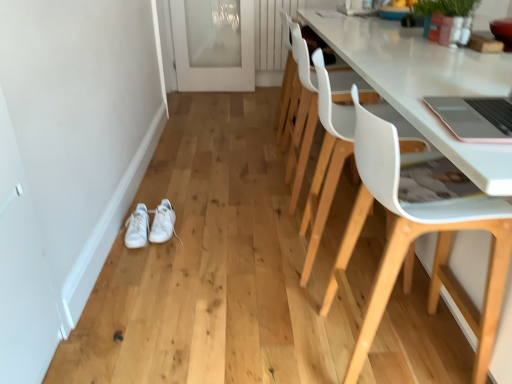
Locate an element on the screen. This screenshot has height=384, width=512. white leather sneakers at lower left, which is counted as the 1th footwear, starting from the right is located at coordinates (163, 223).

In order to face white plastic chair at center, the first chair in the back-to-front sequence, should I rotate leftwards or rightwards?

Rotate your view right by about 10.104°.

Measure the distance between white plastic chair at right, the first chair in the front-to-back sequence, and camera.

37.41 inches.

This screenshot has height=384, width=512. Describe the element at coordinates (137, 228) in the screenshot. I see `white leather sneakers at lower left, the second footwear from the right` at that location.

Locate an element on the screen. white leather sneakers at lower left, which is counted as the 1th footwear, starting from the right is located at coordinates (163, 223).

Can you tell me how much white plastic chair at right, marked as the second chair in a back-to-front arrangement, and white plastic chair at right, which is the 3th chair in back-to-front order, differ in facing direction?

The angular difference between white plastic chair at right, marked as the second chair in a back-to-front arrangement, and white plastic chair at right, which is the 3th chair in back-to-front order, is 6.26 degrees.

From the image's perspective, which object appears higher, white plastic chair at right, marked as the second chair in a back-to-front arrangement, or white plastic chair at right, which is the 3th chair in back-to-front order?

white plastic chair at right, marked as the second chair in a back-to-front arrangement, is shown above in the image.

Would you say white plastic chair at right, the first chair in the front-to-back sequence, is part of white plastic chair at right, which appears as the 2th chair when viewed from the front,'s contents?

Definitely not — white plastic chair at right, the first chair in the front-to-back sequence, is not inside white plastic chair at right, which appears as the 2th chair when viewed from the front.

From the picture: Considering the sizes of objects white leather sneakers at lower left, which is counted as the first footwear, starting from the left, and white leather sneakers at lower left, which is counted as the 1th footwear, starting from the right, in the image provided, who is taller, white leather sneakers at lower left, which is counted as the first footwear, starting from the left, or white leather sneakers at lower left, which is counted as the 1th footwear, starting from the right,?

With more height is white leather sneakers at lower left, which is counted as the first footwear, starting from the left.

From the image's perspective, which is below, white leather sneakers at lower left, the second footwear from the right, or white leather sneakers at lower left, which is counted as the 1th footwear, starting from the right?

white leather sneakers at lower left, the second footwear from the right, appears lower in the image.

The image size is (512, 384). Identify the location of footwear above the white leather sneakers at lower left, which is counted as the first footwear, starting from the left (from the image's perspective). (163, 223).

Does point (131, 235) lie behind point (167, 225)?

No.

Which of these two, white leather sneakers at lower left, marked as the 2th footwear in a left-to-right arrangement, or white plastic chair at right, which is the 3th chair in back-to-front order, stands taller?

white plastic chair at right, which is the 3th chair in back-to-front order, is taller.

Does white leather sneakers at lower left, which is counted as the 1th footwear, starting from the right, appear on the left side of white plastic chair at right, the first chair in the front-to-back sequence?

Yes.

Is point (173, 218) closer to viewer compared to point (356, 161)?

No.

From a real-world perspective, is white plastic chair at right, which is the 3th chair in back-to-front order, positioned over white plastic chair at center, the first chair in the back-to-front sequence, based on gravity?

Incorrect, from a real-world perspective, white plastic chair at right, which is the 3th chair in back-to-front order, is lower than white plastic chair at center, the first chair in the back-to-front sequence.

Which of these two, white plastic chair at right, which is the 3th chair in back-to-front order, or white plastic chair at center, the first chair in the back-to-front sequence, is wider?

white plastic chair at right, which is the 3th chair in back-to-front order, is wider.

Considering the positions of objects white plastic chair at right, the first chair in the front-to-back sequence, and white plastic chair at center, the first chair in the back-to-front sequence, in the image provided, who is more to the left, white plastic chair at right, the first chair in the front-to-back sequence, or white plastic chair at center, the first chair in the back-to-front sequence,?

white plastic chair at center, the first chair in the back-to-front sequence, is more to the left.

Which of these two, white plastic chair at right, which is the 3th chair in back-to-front order, or white plastic chair at center, positioned as the third chair in front-to-back order, is smaller?

Smaller between the two is white plastic chair at center, positioned as the third chair in front-to-back order.

Is white leather sneakers at lower left, marked as the 2th footwear in a left-to-right arrangement, taller or shorter than transparent glass door at upper center?

In the image, white leather sneakers at lower left, marked as the 2th footwear in a left-to-right arrangement, appears to be shorter than transparent glass door at upper center.

Which object is positioned more to the right, white leather sneakers at lower left, which is counted as the 1th footwear, starting from the right, or transparent glass door at upper center?

From the viewer's perspective, transparent glass door at upper center appears more on the right side.

Can you confirm if white leather sneakers at lower left, marked as the 2th footwear in a left-to-right arrangement, is smaller than transparent glass door at upper center?

Correct, white leather sneakers at lower left, marked as the 2th footwear in a left-to-right arrangement, occupies less space than transparent glass door at upper center.

Would you say white leather sneakers at lower left, marked as the 2th footwear in a left-to-right arrangement, is inside or outside transparent glass door at upper center?

The correct answer is: outside.

Considering the sizes of objects white plastic chair at right, which is the 3th chair in back-to-front order, and white leather sneakers at lower left, which is counted as the first footwear, starting from the left, in the image provided, who is bigger, white plastic chair at right, which is the 3th chair in back-to-front order, or white leather sneakers at lower left, which is counted as the first footwear, starting from the left,?

white plastic chair at right, which is the 3th chair in back-to-front order.

Is white plastic chair at right, which is the 3th chair in back-to-front order, wider than white leather sneakers at lower left, which is counted as the first footwear, starting from the left?

Indeed, white plastic chair at right, which is the 3th chair in back-to-front order, has a greater width compared to white leather sneakers at lower left, which is counted as the first footwear, starting from the left.

How many degrees apart are the facing directions of white plastic chair at right, which is the 3th chair in back-to-front order, and white leather sneakers at lower left, which is counted as the first footwear, starting from the left?

There is a 90.6-degree angle between the facing directions of white plastic chair at right, which is the 3th chair in back-to-front order, and white leather sneakers at lower left, which is counted as the first footwear, starting from the left.

Is the position of white plastic chair at right, the first chair in the front-to-back sequence, less distant than that of white leather sneakers at lower left, which is counted as the first footwear, starting from the left?

Yes, it is in front of white leather sneakers at lower left, which is counted as the first footwear, starting from the left.

From the image's perspective, is white plastic chair at center, the first chair in the back-to-front sequence, on top of white leather sneakers at lower left, which is counted as the 1th footwear, starting from the right?

Yes, from the image's perspective, white plastic chair at center, the first chair in the back-to-front sequence, is on top of white leather sneakers at lower left, which is counted as the 1th footwear, starting from the right.

Which is less distant, (338, 93) or (168, 233)?

Point (338, 93) is positioned closer to the camera compared to point (168, 233).

Which object is thinner, white plastic chair at center, the first chair in the back-to-front sequence, or white leather sneakers at lower left, marked as the 2th footwear in a left-to-right arrangement?

white leather sneakers at lower left, marked as the 2th footwear in a left-to-right arrangement.

Based on their positions, is white plastic chair at center, positioned as the third chair in front-to-back order, located to the left or right of white leather sneakers at lower left, which is counted as the 1th footwear, starting from the right?

Based on their positions, white plastic chair at center, positioned as the third chair in front-to-back order, is located to the right of white leather sneakers at lower left, which is counted as the 1th footwear, starting from the right.

Where is `chair that is the 1st object located above the white plastic chair at right, which is the 3th chair in back-to-front order (from the image's perspective)`? The height and width of the screenshot is (384, 512). chair that is the 1st object located above the white plastic chair at right, which is the 3th chair in back-to-front order (from the image's perspective) is located at coordinates (326, 162).

Where is `footwear that appears in front of the white leather sneakers at lower left, marked as the 2th footwear in a left-to-right arrangement`? footwear that appears in front of the white leather sneakers at lower left, marked as the 2th footwear in a left-to-right arrangement is located at coordinates (137, 228).

Considering their positions, is white leather sneakers at lower left, which is counted as the first footwear, starting from the left, positioned closer to transparent glass door at upper center than white plastic chair at right, marked as the second chair in a back-to-front arrangement?

Based on the image, white leather sneakers at lower left, which is counted as the first footwear, starting from the left, appears to be nearer to transparent glass door at upper center.

Which object lies further to the anchor point transparent glass door at upper center, white plastic chair at right, marked as the second chair in a back-to-front arrangement, or white plastic chair at center, positioned as the third chair in front-to-back order?

The object further to transparent glass door at upper center is white plastic chair at right, marked as the second chair in a back-to-front arrangement.

From the image, which object appears to be farther from white leather sneakers at lower left, which is counted as the 1th footwear, starting from the right, white plastic chair at right, which appears as the 2th chair when viewed from the front, or white leather sneakers at lower left, which is counted as the first footwear, starting from the left?

white plastic chair at right, which appears as the 2th chair when viewed from the front, lies further to white leather sneakers at lower left, which is counted as the 1th footwear, starting from the right, than the other object.

Based on their spatial positions, is white plastic chair at right, which is the 3th chair in back-to-front order, or white leather sneakers at lower left, which is counted as the 1th footwear, starting from the right, further from white plastic chair at center, positioned as the third chair in front-to-back order?

Among the two, white leather sneakers at lower left, which is counted as the 1th footwear, starting from the right, is located further to white plastic chair at center, positioned as the third chair in front-to-back order.

Considering their positions, is transparent glass door at upper center positioned further to white plastic chair at right, which appears as the 2th chair when viewed from the front, than white leather sneakers at lower left, the second footwear from the right?

transparent glass door at upper center is further to white plastic chair at right, which appears as the 2th chair when viewed from the front.

Considering their positions, is white plastic chair at center, the first chair in the back-to-front sequence, positioned further to white plastic chair at right, marked as the second chair in a back-to-front arrangement, than white plastic chair at right, which is the 3th chair in back-to-front order?

The object further to white plastic chair at right, marked as the second chair in a back-to-front arrangement, is white plastic chair at center, the first chair in the back-to-front sequence.

When comparing their distances from white plastic chair at right, the first chair in the front-to-back sequence, does white leather sneakers at lower left, which is counted as the first footwear, starting from the left, or white plastic chair at right, marked as the second chair in a back-to-front arrangement, seem closer?

The object closer to white plastic chair at right, the first chair in the front-to-back sequence, is white plastic chair at right, marked as the second chair in a back-to-front arrangement.

From the image, which object appears to be nearer to white leather sneakers at lower left, marked as the 2th footwear in a left-to-right arrangement, white leather sneakers at lower left, which is counted as the first footwear, starting from the left, or transparent glass door at upper center?

white leather sneakers at lower left, which is counted as the first footwear, starting from the left.

Find the location of a particular element. footwear between white leather sneakers at lower left, the second footwear from the right, and white plastic chair at center, positioned as the third chair in front-to-back order, from left to right is located at coordinates (163, 223).

Identify the location of chair located between white leather sneakers at lower left, which is counted as the first footwear, starting from the left, and white plastic chair at right, marked as the second chair in a back-to-front arrangement, in the left-right direction. (301, 114).

Find the location of a particular element. chair positioned between white plastic chair at right, which is the 3th chair in back-to-front order, and white plastic chair at center, the first chair in the back-to-front sequence, from near to far is located at coordinates (326, 162).

Image resolution: width=512 pixels, height=384 pixels. In order to click on footwear positioned between white plastic chair at right, the first chair in the front-to-back sequence, and white leather sneakers at lower left, marked as the 2th footwear in a left-to-right arrangement, from near to far in this screenshot , I will do `click(137, 228)`.